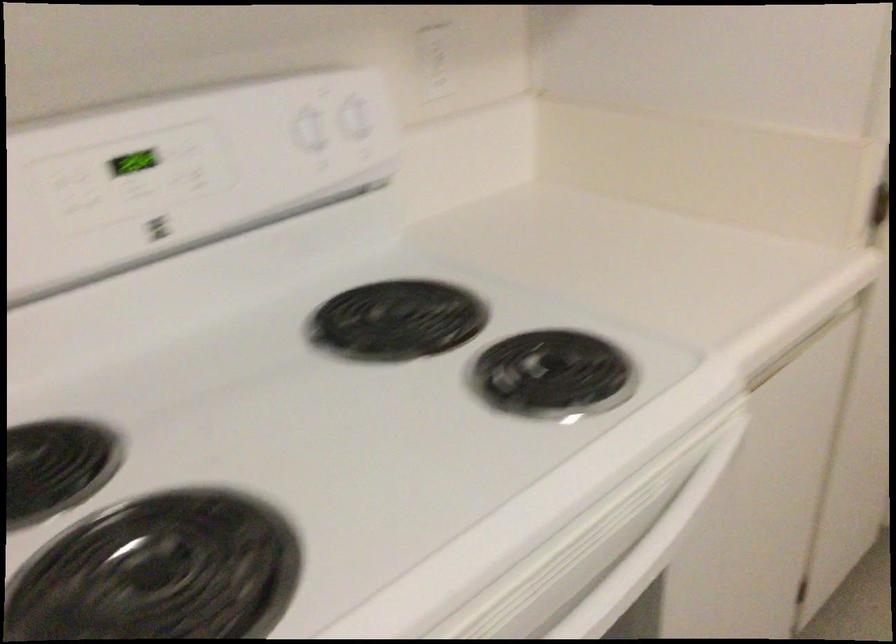
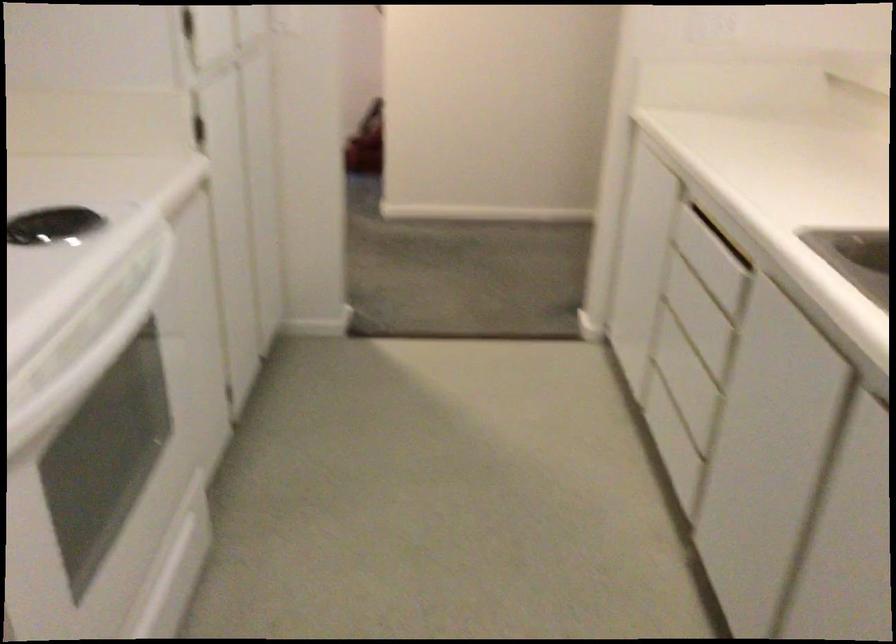
Question: The camera is either moving clockwise (left) or counter-clockwise (right) around the object. The first image is from the beginning of the video and the second image is from the end. Is the camera moving left or right when shooting the video?

Choices:
 (A) Left
 (B) Right

Answer: (A)